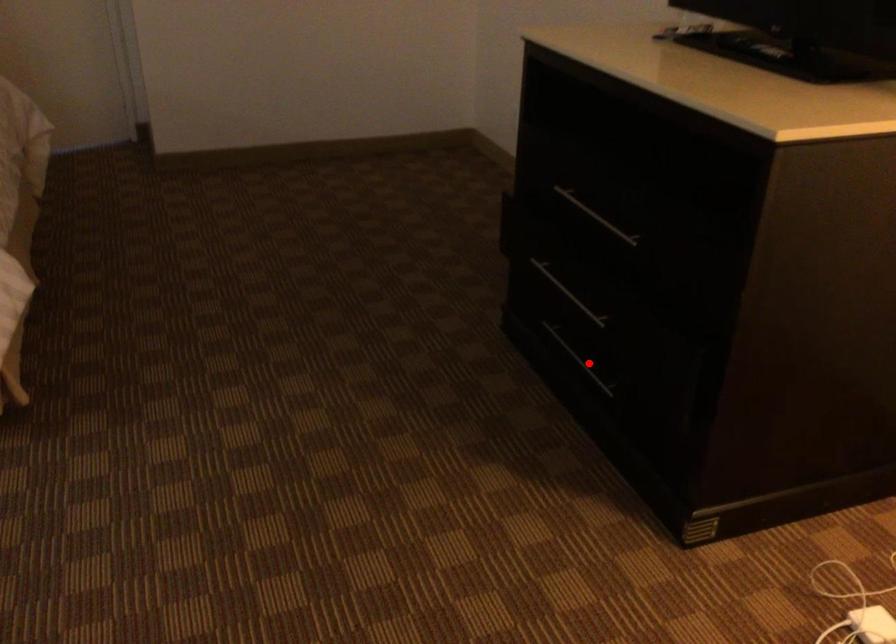
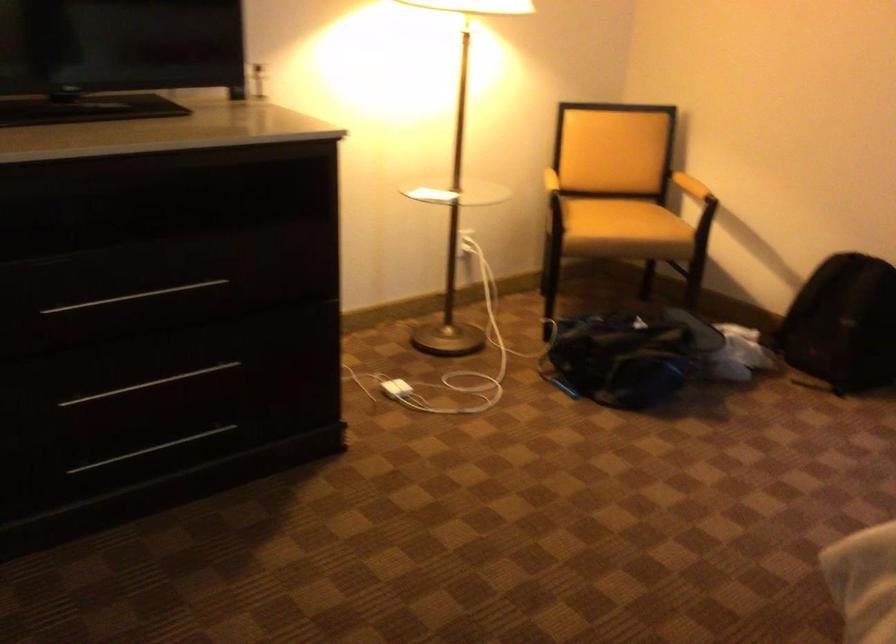
Locate, in the second image, the point that corresponds to the highlighted location in the first image.

(151, 449)